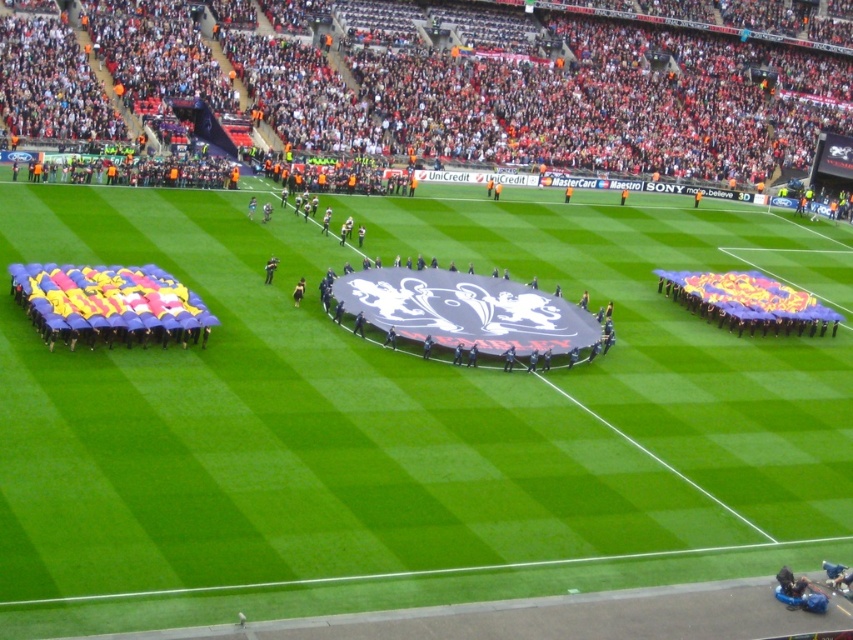
Describe the element at coordinates (407, 417) in the screenshot. I see `green grass football field at center` at that location.

Based on the photo, between green grass football field at center and red fabric crowd at upper center, which one is positioned lower?

Positioned lower is green grass football field at center.

Between point (219, 458) and point (454, 67), which one is positioned in front?

Point (219, 458)

The width and height of the screenshot is (853, 640). Find the location of `green grass football field at center`. green grass football field at center is located at coordinates (407, 417).